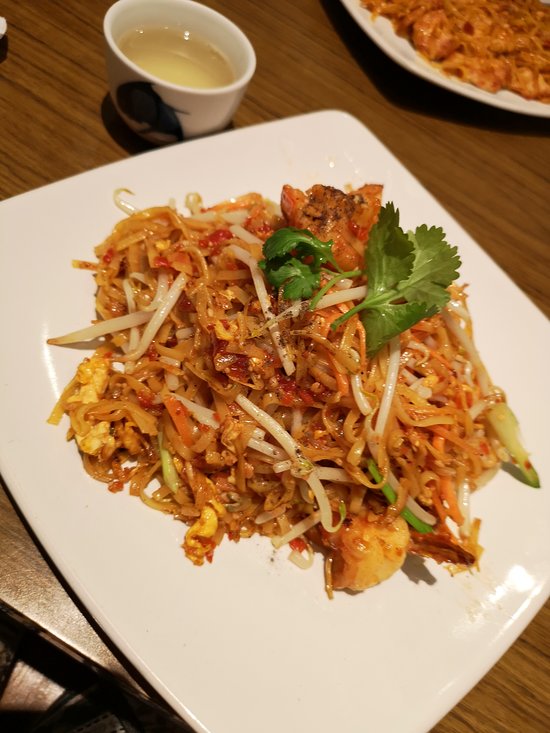
Locate an element on the screen. The height and width of the screenshot is (733, 550). plate is located at coordinates (288, 610), (401, 48).